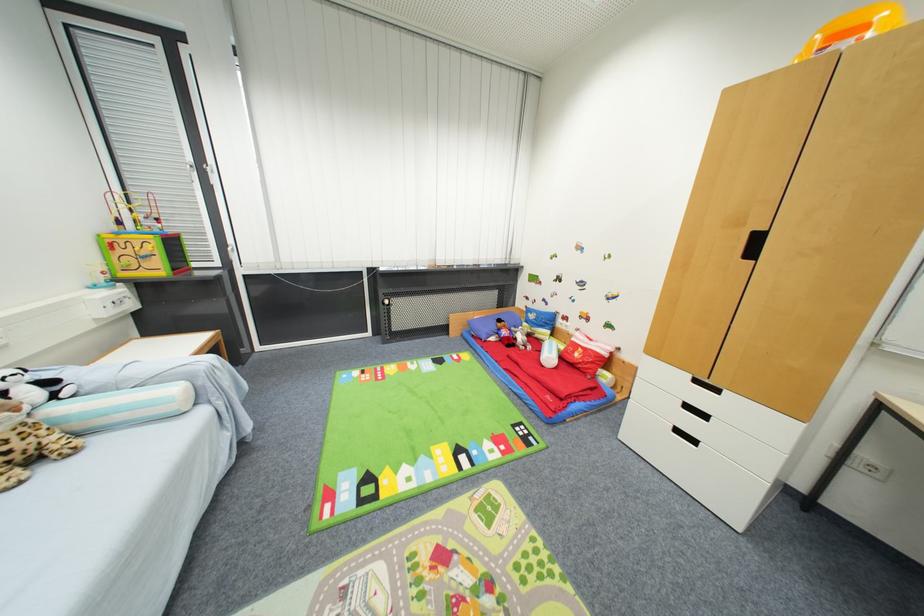
What do you see at coordinates (505, 333) in the screenshot?
I see `the small doll toy` at bounding box center [505, 333].